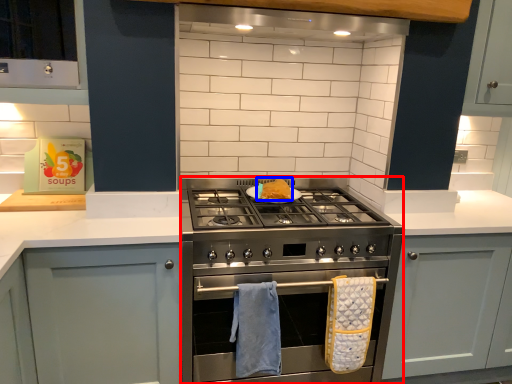
Question: Among these objects, which one is nearest to the camera, appliance (highlighted by a red box) or food (highlighted by a blue box)?

Choices:
 (A) appliance
 (B) food

Answer: (A)